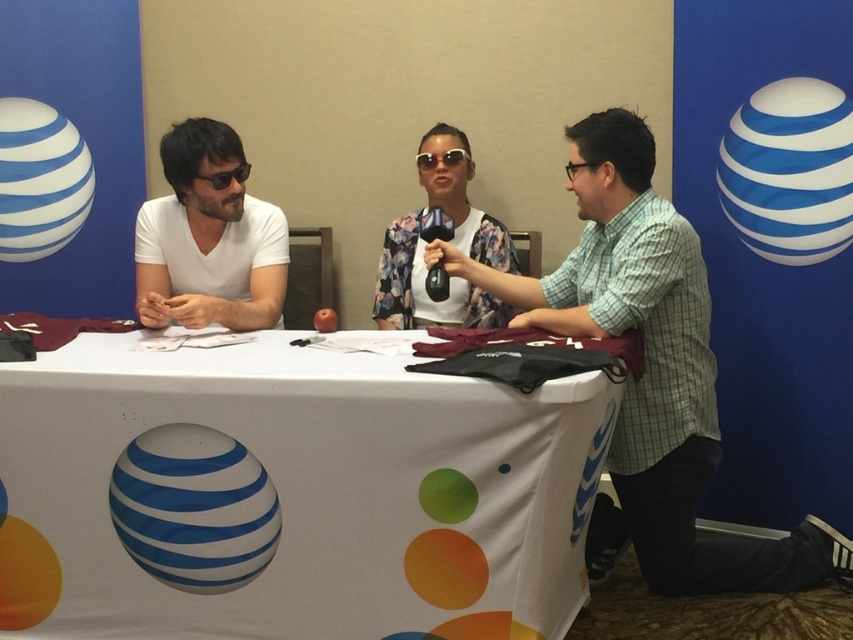
Question: Which of the following is the closest to the observer?

Choices:
 (A) (468, 528)
 (B) (498, 308)

Answer: (A)

Question: Which is nearer to the matte white shirt at left?

Choices:
 (A) white fabric table at center
 (B) matte black sunglasses at left

Answer: (B)

Question: Does floral fabric shirt at center have a smaller size compared to matte black sunglasses at left?

Choices:
 (A) no
 (B) yes

Answer: (A)

Question: Which object appears closest to the camera in this image?

Choices:
 (A) matte white shirt at left
 (B) white fabric table at center
 (C) checkered fabric shirt at center

Answer: (B)

Question: Is white fabric table at center bigger than floral fabric shirt at center?

Choices:
 (A) yes
 (B) no

Answer: (A)

Question: Observing the image, what is the correct spatial positioning of checkered fabric shirt at center in reference to matte black sunglasses at left?

Choices:
 (A) right
 (B) left

Answer: (A)